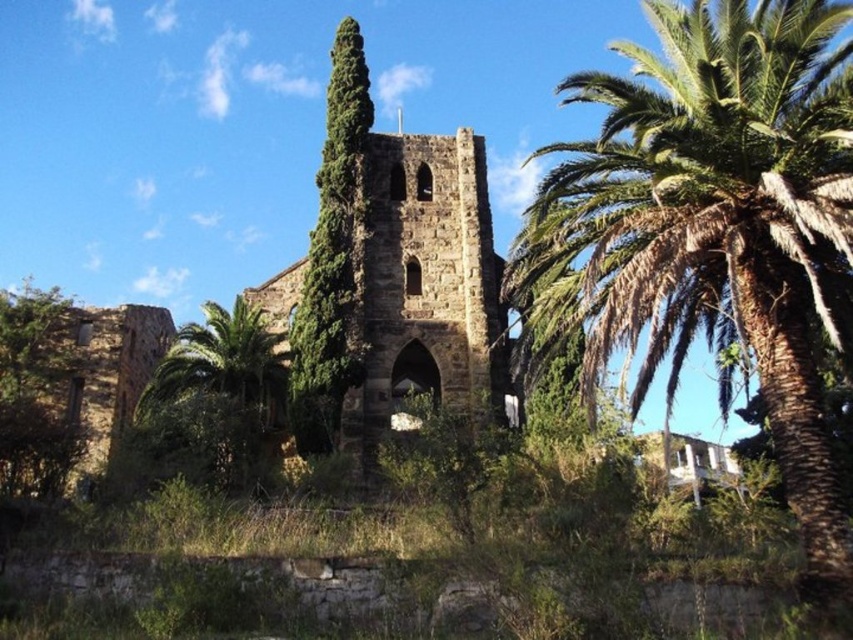
You are standing in a field near the brown stone church at center. You want to take a photo of the church with your smartphone. Considering the distance, will you need to zoom in to capture the entire structure in the frame?

The brown stone church at center is 57.18 meters away from the viewer. Since smartphones typically have a wide enough angle to capture distant structures without zooming, you likely won not need to zoom in to include the entire church in the photo.

Looking at this image, you are standing in front of an ancient stone structure with a tower covered in greenery. There are two points marked on the image. One is at coordinates point (421, 236) and the other at point (364, 88). Which point is nearer to you?

Point (421, 236) is closer to the viewer than point (364, 88).

You are an archaeologist examining the ancient stone structure. You notice two trees in the scene. Which tree, the green leafy palm tree at center or the green leafy tree at left, is closer to the stone structure?

The green leafy palm tree at center is positioned under the green leafy tree at left, meaning it is closer to the stone structure.